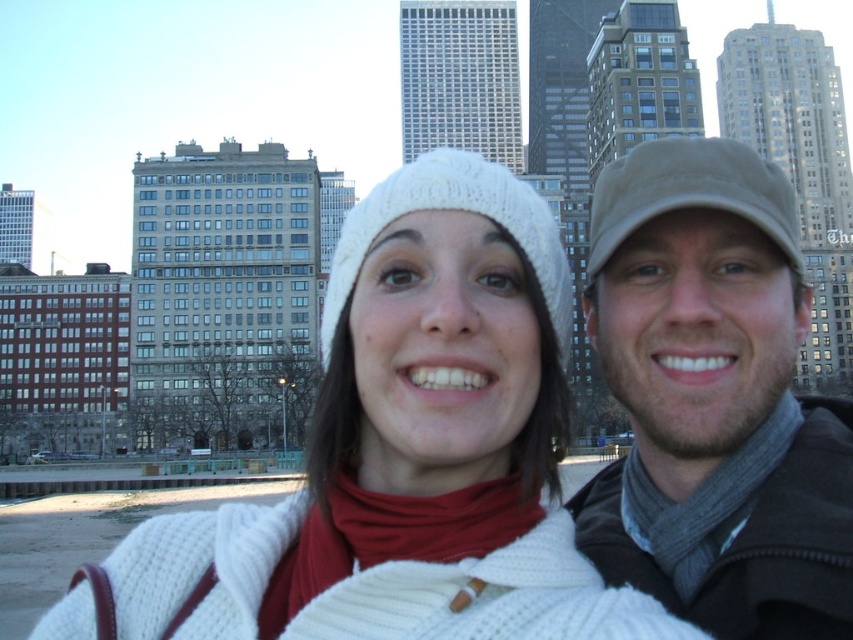
You are a fashion designer observing two caps in the city scene. The khaki fabric cap at upper right and the beige fabric cap at upper right. Which one has a narrower brim?

The khaki fabric cap at upper right has a narrower brim than the beige fabric cap at upper right because it is thinner.

You are a photographer trying to capture a closeup of the white knitted hat at center. Given that your camera has a focal length of 50mm and you are currently 10 meters away from the hat, will you be able to fill the frame with the hat without moving closer?

The position of white knitted hat at center is at point (456, 209), which indicates its location in the frame. However, without knowing the size of the hat, it is impossible to determine if the camera can fill the frame with the hat at 50mm and 10 meters distance. Additional information about the hat size is required to make this assessment.

You are looking at a city scene with two people. There is a khaki fabric cap at upper right and a white knitted hat at center. From your perspective, which object is closer to you?

The khaki fabric cap at upper right is closer to you because it is in front of the white knitted hat at center.